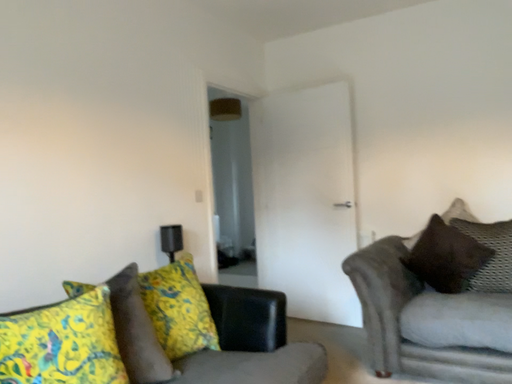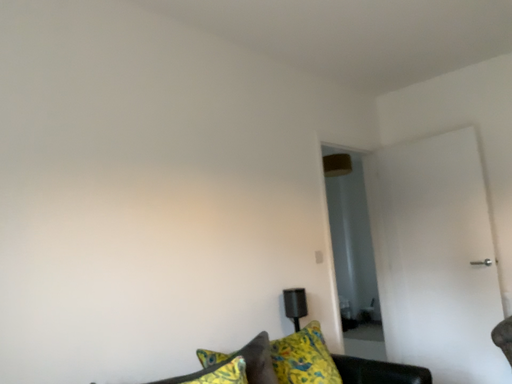
Question: Which way did the camera rotate in the video?

Choices:
 (A) rotated left
 (B) rotated right

Answer: (A)